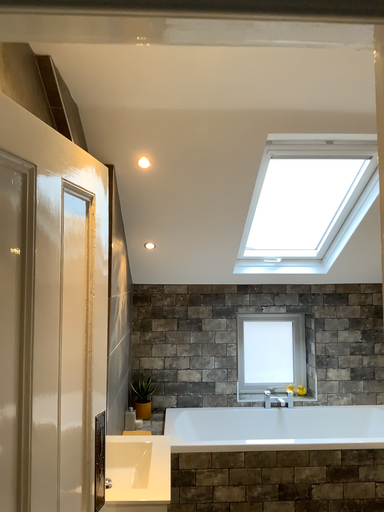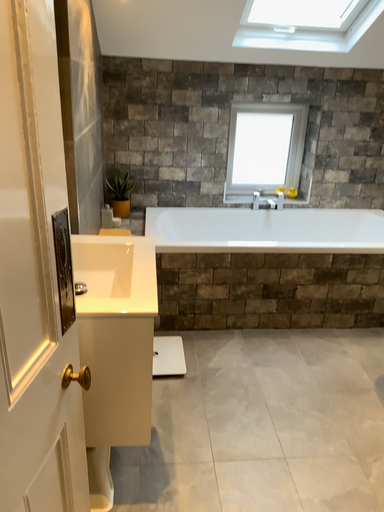
Question: Which way did the camera rotate in the video?

Choices:
 (A) rotated upward
 (B) rotated downward

Answer: (B)